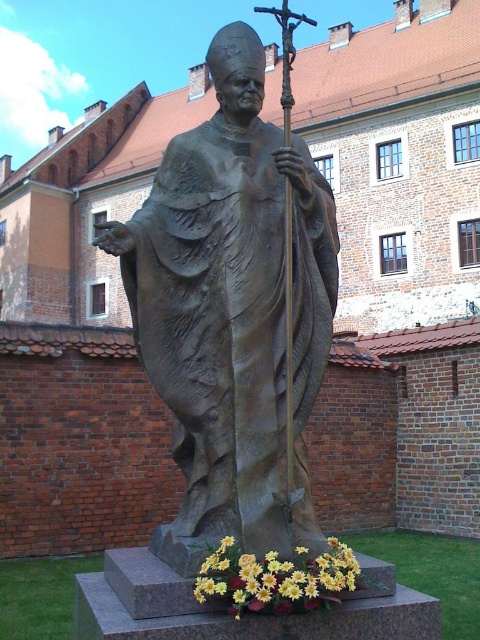
Question: Can you confirm if bronze statue at center is positioned above yellow matte flowers at lower center?

Choices:
 (A) yes
 (B) no

Answer: (A)

Question: Which point is closer to the camera?

Choices:
 (A) (195, 586)
 (B) (105, 250)

Answer: (A)

Question: Which object is closer to the camera taking this photo?

Choices:
 (A) yellow matte flowers at lower center
 (B) bronze statue at center

Answer: (A)

Question: Is bronze statue at center to the left of yellow matte flowers at lower center from the viewer's perspective?

Choices:
 (A) yes
 (B) no

Answer: (A)

Question: Can you confirm if bronze statue at center is bigger than yellow matte flowers at lower center?

Choices:
 (A) no
 (B) yes

Answer: (B)